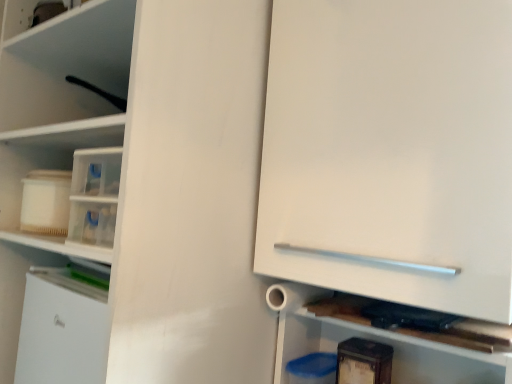
Question: Considering the positions of point (310, 120) and point (303, 314), is point (310, 120) closer or farther from the camera than point (303, 314)?

Choices:
 (A) closer
 (B) farther

Answer: (A)

Question: From a real-world perspective, is white glossy cabinet at center physically located above or below wooden cutting board at lower right?

Choices:
 (A) above
 (B) below

Answer: (A)

Question: Considering the positions of white glossy cabinet at center and wooden cutting board at lower right in the image, is white glossy cabinet at center bigger or smaller than wooden cutting board at lower right?

Choices:
 (A) big
 (B) small

Answer: (A)

Question: Is point (415, 336) closer or farther from the camera than point (506, 281)?

Choices:
 (A) farther
 (B) closer

Answer: (A)

Question: Relative to white glossy cabinet at center, is wooden cutting board at lower right in front or behind?

Choices:
 (A) behind
 (B) front

Answer: (A)

Question: Would you say wooden cutting board at lower right is to the left or to the right of white glossy cabinet at center in the picture?

Choices:
 (A) right
 (B) left

Answer: (B)

Question: Is wooden cutting board at lower right inside the boundaries of white glossy cabinet at center, or outside?

Choices:
 (A) inside
 (B) outside

Answer: (B)